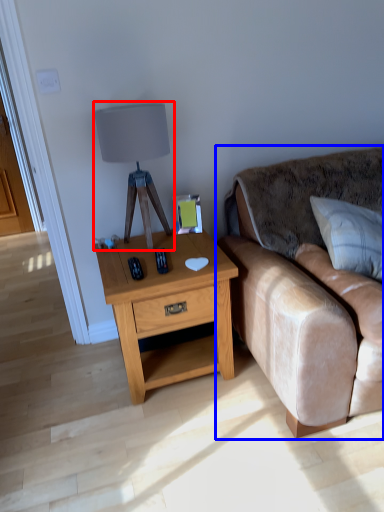
Question: Which point is further to the camera, table lamp (highlighted by a red box) or studio couch (highlighted by a blue box)?

Choices:
 (A) table lamp
 (B) studio couch

Answer: (A)